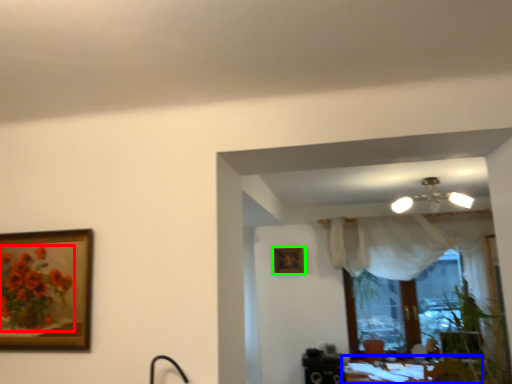
Question: Which object is the closest to the flower (highlighted by a red box)? Choose among these: table (highlighted by a blue box) or picture frame (highlighted by a green box).

Choices:
 (A) table
 (B) picture frame

Answer: (B)